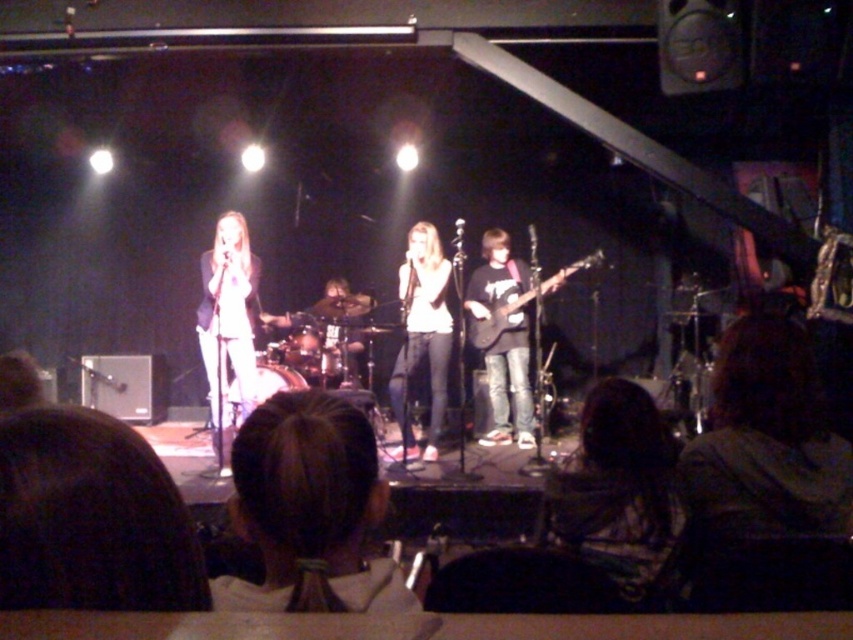
You are a photographer at the back of the venue trying to capture the stage. You notice the brown hair at center and the black matte guitar at center. Which object would appear smaller in your photo?

The brown hair at center would appear smaller in the photo because it occupies less space than the black matte guitar at center.

You are a photographer at the back of the venue trying to capture a clear shot of both the black matte guitar at center and the white matte shirt at center. Since the guitar is taller than the shirt, how should you adjust your camera angle to ensure both are fully visible in the frame?

Since the black matte guitar at center is taller than the white matte shirt at center, you should position your camera slightly lower to accommodate the height of the guitar while still capturing the shirt within the frame.